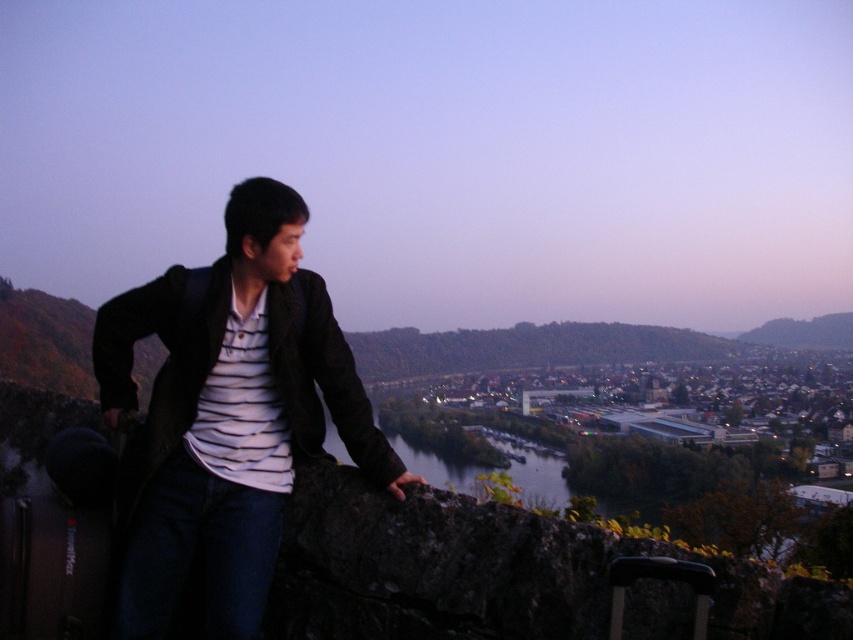
Question: Which object is farther from the camera taking this photo?

Choices:
 (A) matte black jacket at left
 (B) dark water at center
 (C) white striped shirt at center

Answer: (B)

Question: Among these points, which one is nearest to the camera?

Choices:
 (A) (450, 472)
 (B) (279, 400)

Answer: (B)

Question: Is matte black jacket at left above dark water at center?

Choices:
 (A) no
 (B) yes

Answer: (B)

Question: Based on their relative distances, which object is farther from the dark water at center?

Choices:
 (A) matte black jacket at left
 (B) white striped shirt at center

Answer: (A)

Question: Is matte black jacket at left to the left of white striped shirt at center from the viewer's perspective?

Choices:
 (A) yes
 (B) no

Answer: (A)

Question: In this image, where is matte black jacket at left located relative to dark water at center?

Choices:
 (A) above
 (B) below

Answer: (A)